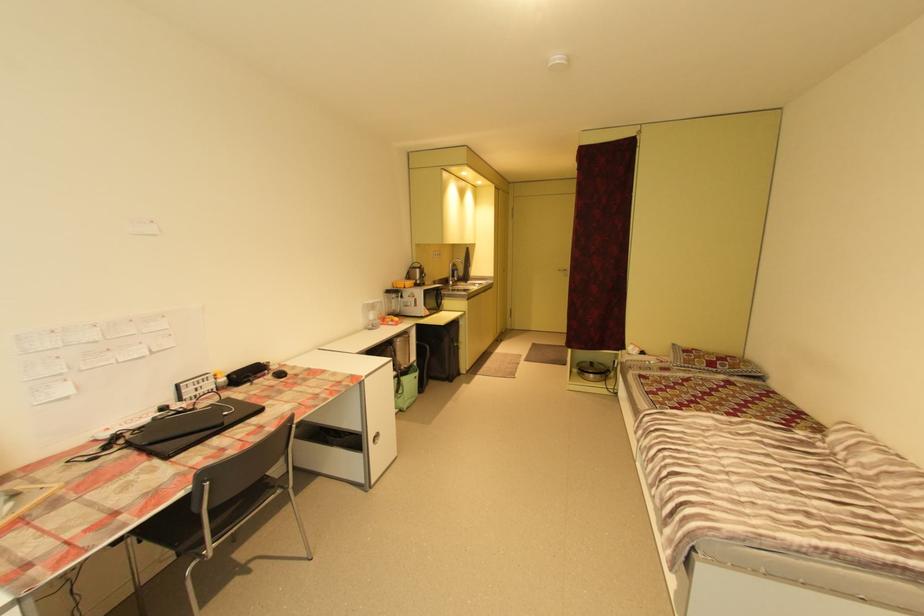
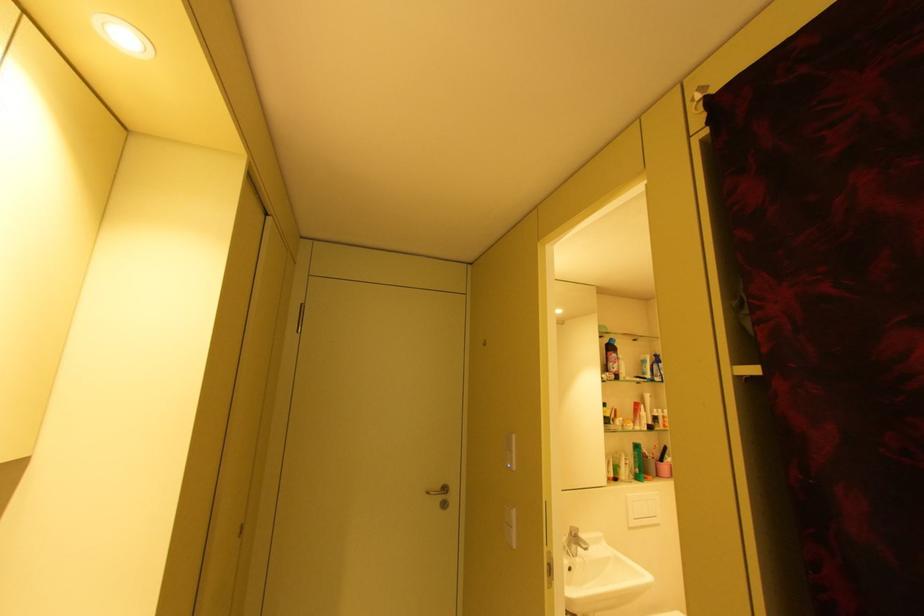
Find the pixel in the second image that matches point 565,270 in the first image.

(434, 493)